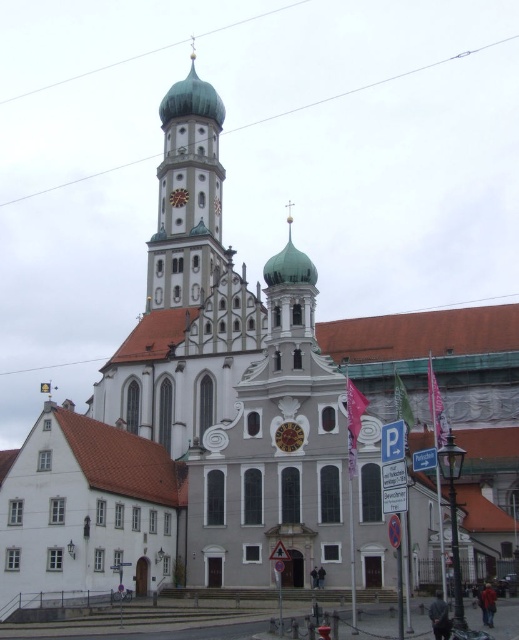
Does white stone tower at center appear on the right side of gold metallic clock at center?

Incorrect, white stone tower at center is not on the right side of gold metallic clock at center.

The width and height of the screenshot is (519, 640). Describe the element at coordinates (187, 196) in the screenshot. I see `white stone tower at center` at that location.

Find the location of `white stone tower at center`. white stone tower at center is located at coordinates (187, 196).